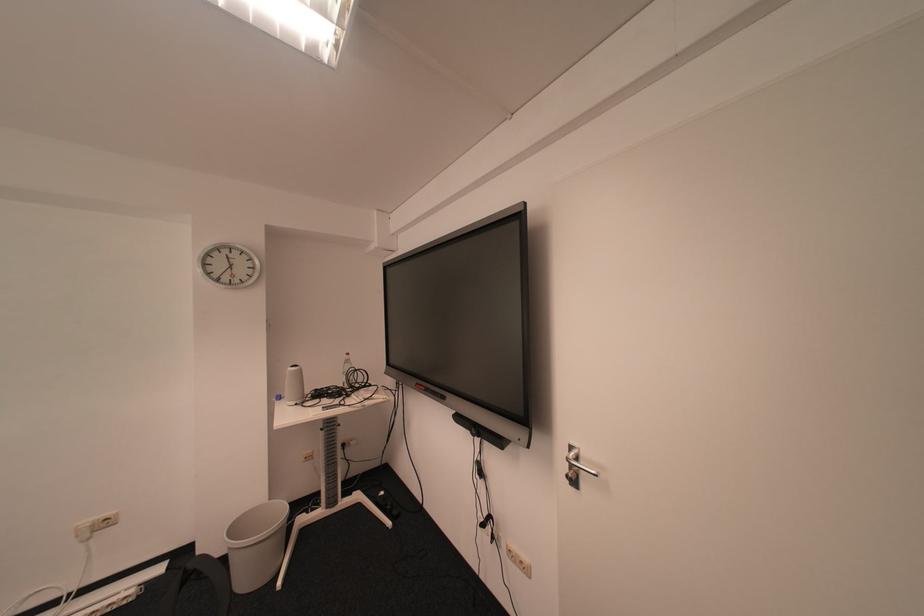
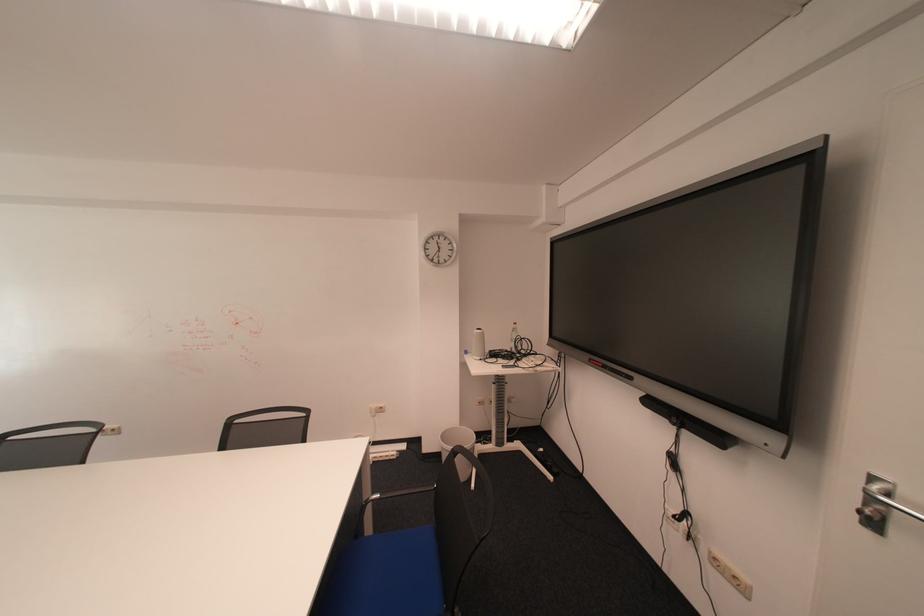
Find the pixel in the second image that matches point (582, 466) in the first image.

(884, 501)